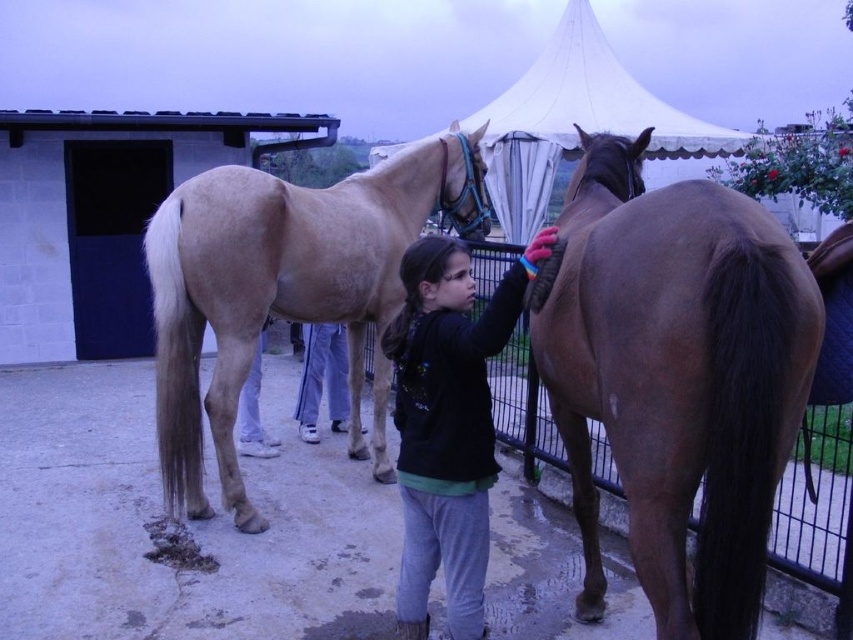
Looking at this image, you are a photographer trying to capture the girl interacting with the horse. You notice the black fleece jacket at center and the white cotton pants at center. Which clothing item appears closer to you in this composition?

The black fleece jacket at center is closer to the viewer than the white cotton pants at center.

You are a photographer aiming to capture a clear photo of the brown matte horse at right and the white fabric pants at lower center. Based on their positions, which object should you focus on first to ensure both are in sharp focus?

The brown matte horse at right is closer to the viewer than the white fabric pants at lower center, so you should focus on the brown matte horse at right first to ensure both are in sharp focus.

In the scene shown: You are a photographer trying to capture a clear shot of the brown matte horse at right and the black fleece jacket at center. Which object should you focus on first to ensure it appears sharp in your photo?

The brown matte horse at right is closer to the viewer than the black fleece jacket at center, so you should focus on the brown matte horse at right first to ensure it appears sharp.